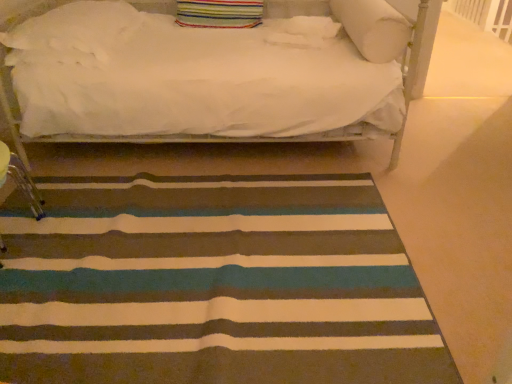
Question: Considering the relative sizes of white soft pillow at upper right, marked as the 1th pillow in a right-to-left arrangement, and striped carpet at center in the image provided, is white soft pillow at upper right, marked as the 1th pillow in a right-to-left arrangement, shorter than striped carpet at center?

Choices:
 (A) yes
 (B) no

Answer: (B)

Question: Considering the relative positions of white soft pillow at upper right, which ranks as the fourth pillow in left-to-right order, and striped carpet at center in the image provided, is white soft pillow at upper right, which ranks as the fourth pillow in left-to-right order, to the left of striped carpet at center from the viewer's perspective?

Choices:
 (A) no
 (B) yes

Answer: (A)

Question: From a real-world perspective, is white soft pillow at upper right, marked as the 1th pillow in a right-to-left arrangement, over striped carpet at center?

Choices:
 (A) no
 (B) yes

Answer: (B)

Question: Can you confirm if white soft pillow at upper right, marked as the 1th pillow in a right-to-left arrangement, is taller than striped carpet at center?

Choices:
 (A) no
 (B) yes

Answer: (B)

Question: From the image's perspective, is white soft pillow at upper right, which ranks as the fourth pillow in left-to-right order, over striped carpet at center?

Choices:
 (A) no
 (B) yes

Answer: (B)

Question: Does white soft pillow at upper right, marked as the 1th pillow in a right-to-left arrangement, have a smaller size compared to striped carpet at center?

Choices:
 (A) no
 (B) yes

Answer: (B)

Question: Does white soft pillow at upper right, marked as the 1th pillow in a right-to-left arrangement, have a larger size compared to white soft pillow at upper center, the third pillow positioned from the left?

Choices:
 (A) no
 (B) yes

Answer: (B)

Question: Is white soft pillow at upper center, acting as the second pillow starting from the right, surrounded by white soft pillow at upper right, which ranks as the fourth pillow in left-to-right order?

Choices:
 (A) no
 (B) yes

Answer: (A)

Question: Considering the relative sizes of white soft pillow at upper right, which ranks as the fourth pillow in left-to-right order, and white soft pillow at upper center, acting as the second pillow starting from the right, in the image provided, is white soft pillow at upper right, which ranks as the fourth pillow in left-to-right order, wider than white soft pillow at upper center, acting as the second pillow starting from the right,?

Choices:
 (A) no
 (B) yes

Answer: (B)

Question: From a real-world perspective, is white soft pillow at upper right, which ranks as the fourth pillow in left-to-right order, on top of white soft pillow at upper center, the third pillow positioned from the left?

Choices:
 (A) no
 (B) yes

Answer: (B)

Question: Is white soft pillow at upper right, which ranks as the fourth pillow in left-to-right order, placed right next to white soft pillow at upper center, the third pillow positioned from the left?

Choices:
 (A) no
 (B) yes

Answer: (A)

Question: Can you confirm if white soft pillow at upper right, which ranks as the fourth pillow in left-to-right order, is positioned to the left of white soft pillow at upper center, the third pillow positioned from the left?

Choices:
 (A) no
 (B) yes

Answer: (A)

Question: Considering the relative sizes of striped carpet at center and white soft pillow at upper right, which ranks as the fourth pillow in left-to-right order, in the image provided, is striped carpet at center wider than white soft pillow at upper right, which ranks as the fourth pillow in left-to-right order,?

Choices:
 (A) yes
 (B) no

Answer: (A)